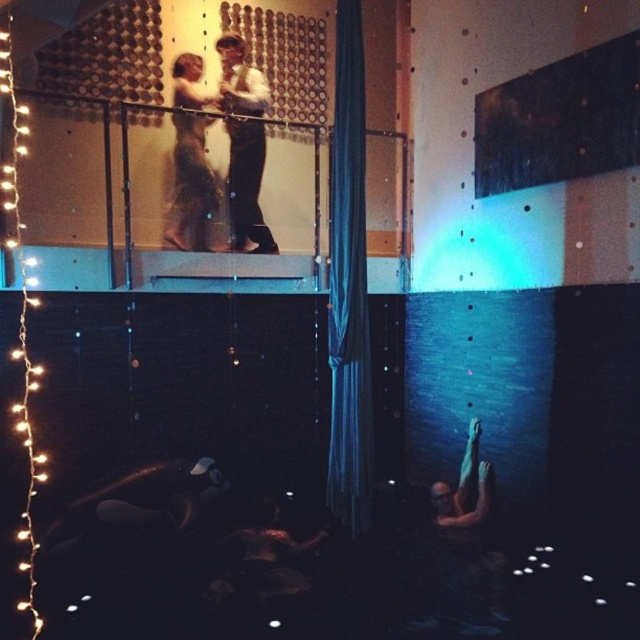
Locate an element on the screen. This screenshot has width=640, height=640. satin white dress at upper center is located at coordinates 189,182.

Is point (196, 225) positioned behind point (470, 458)?

Yes, point (196, 225) is behind point (470, 458).

Does point (193, 237) come in front of point (467, 445)?

No, it is not.

You are a GUI agent. You are given a task and a screenshot of the screen. Output one action in this format:
    pyautogui.click(x=<x>, y=<y>)
    Task: Click on the satin white dress at upper center
    The image size is (640, 640).
    Given the screenshot: What is the action you would take?
    pyautogui.click(x=189, y=182)

Is blue silky curtain at center below smooth skin man at lower right?

No.

Does blue silky curtain at center appear on the left side of smooth skin man at lower right?

Yes, blue silky curtain at center is to the left of smooth skin man at lower right.

You are a GUI agent. You are given a task and a screenshot of the screen. Output one action in this format:
    pyautogui.click(x=<x>, y=<y>)
    Task: Click on the blue silky curtain at center
    The height and width of the screenshot is (640, 640).
    Given the screenshot: What is the action you would take?
    pyautogui.click(x=348, y=285)

Identify the location of blue silky curtain at center. (348, 285).

The height and width of the screenshot is (640, 640). What do you see at coordinates (348, 285) in the screenshot?
I see `blue silky curtain at center` at bounding box center [348, 285].

Is blue silky curtain at center bigger than white shirt at upper center?

Yes, blue silky curtain at center is bigger than white shirt at upper center.

The width and height of the screenshot is (640, 640). What do you see at coordinates (348, 285) in the screenshot?
I see `blue silky curtain at center` at bounding box center [348, 285].

Locate an element on the screen. The height and width of the screenshot is (640, 640). blue silky curtain at center is located at coordinates (348, 285).